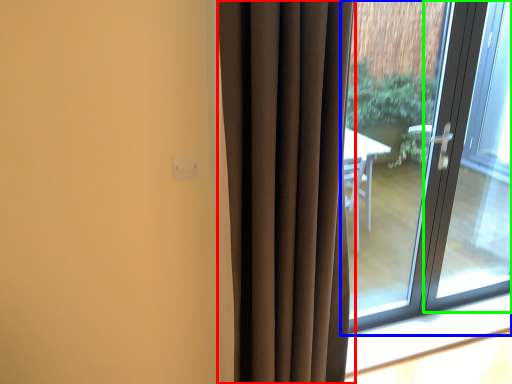
Question: Based on their relative distances, which object is farther from curtain (highlighted by a red box)? Choose from window (highlighted by a blue box) and screen door (highlighted by a green box).

Choices:
 (A) window
 (B) screen door

Answer: (B)